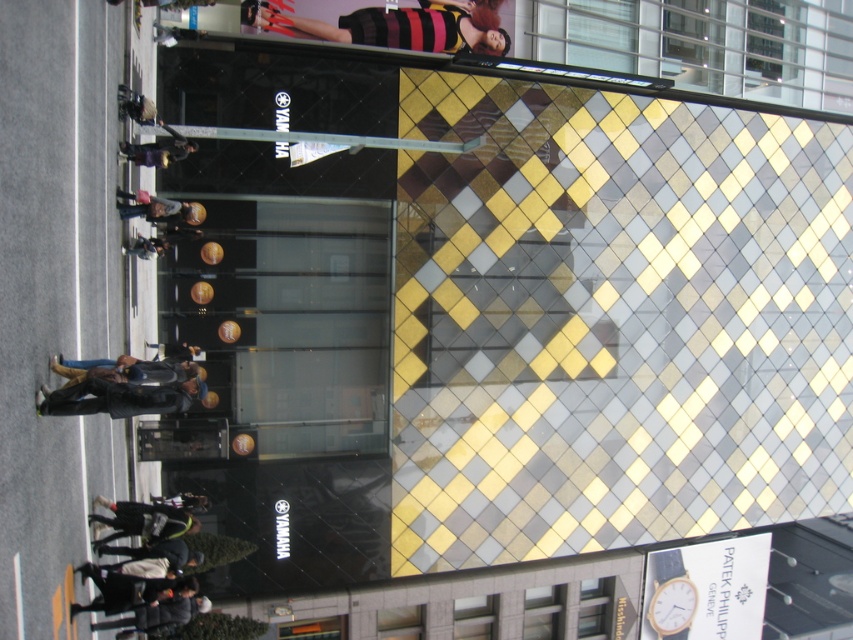
Question: Which object is closer to the camera taking this photo?

Choices:
 (A) dark blue leather jacket at center
 (B) striped knit sweater at upper center

Answer: (A)

Question: Is dark blue leather jacket at center thinner than dark brown leather jacket at upper left?

Choices:
 (A) yes
 (B) no

Answer: (B)

Question: Which of the following is the farthest from the observer?

Choices:
 (A) dark gray jacket at lower left
 (B) dark brown leather jacket at upper left

Answer: (B)

Question: Does striped knit sweater at upper center appear over dark blue leather jacket at center?

Choices:
 (A) yes
 (B) no

Answer: (A)

Question: Can you confirm if dark blue leather jacket at center is positioned above dark gray jacket at lower left?

Choices:
 (A) no
 (B) yes

Answer: (B)

Question: Which point is closer to the camera taking this photo?

Choices:
 (A) (334, 32)
 (B) (108, 520)
 (C) (138, 156)

Answer: (B)